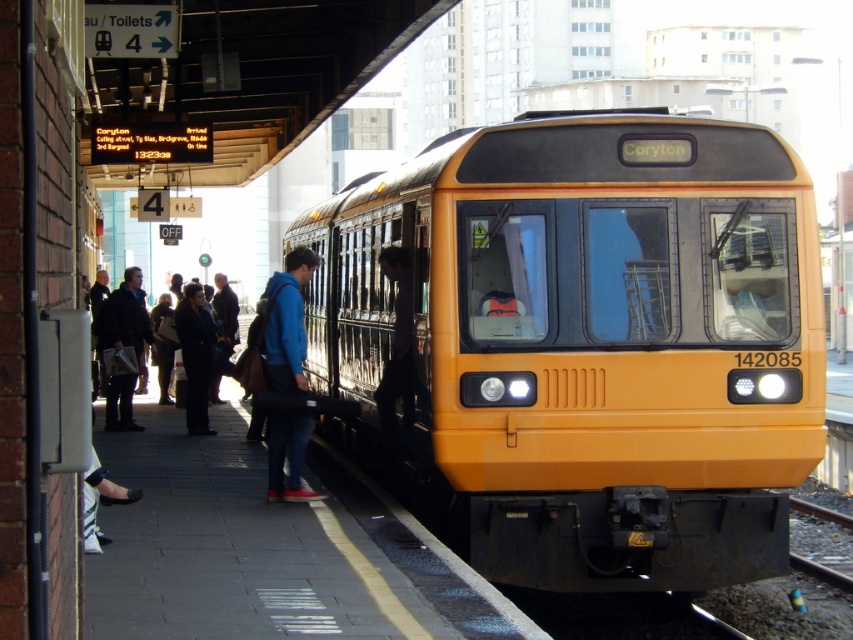
Describe the element at coordinates (589, 340) in the screenshot. This screenshot has width=853, height=640. I see `yellow matte train at center` at that location.

Can you confirm if yellow matte train at center is positioned below blue fabric backpack at center?

Incorrect, yellow matte train at center is not positioned below blue fabric backpack at center.

Find the location of `yellow matte train at center`. yellow matte train at center is located at coordinates (589, 340).

Who is more distant from viewer, [746,387] or [129,300]?

Point [129,300]

Describe the element at coordinates (589, 340) in the screenshot. I see `yellow matte train at center` at that location.

Is point (490, 168) farther from viewer compared to point (119, 285)?

No, (490, 168) is closer to viewer.

Identify the location of yellow matte train at center. The image size is (853, 640). (589, 340).

Which is above, blue fabric backpack at center or dark brown leather jacket at left?

blue fabric backpack at center

From the picture: Who is more forward, (303,435) or (109,403)?

Point (303,435) is more forward.

Locate an element on the screen. Image resolution: width=853 pixels, height=640 pixels. blue fabric backpack at center is located at coordinates (287, 323).